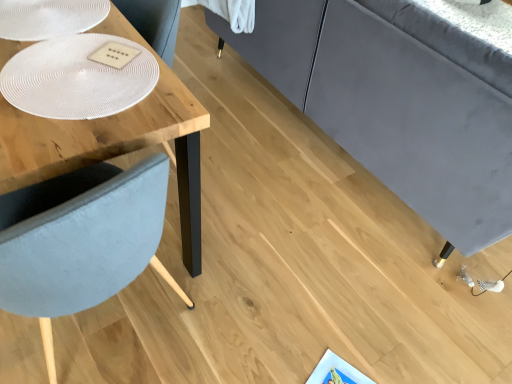
Question: From the image's perspective, is white textured glass plate at upper left, the 1th glass plate when ordered from top to bottom, below wooden table at left?

Choices:
 (A) no
 (B) yes

Answer: (A)

Question: From a real-world perspective, is white textured glass plate at upper left, which is the 2th glass plate in bottom-to-top order, below wooden table at left?

Choices:
 (A) no
 (B) yes

Answer: (A)

Question: Considering the relative sizes of white textured glass plate at upper left, the 1th glass plate when ordered from top to bottom, and wooden table at left in the image provided, is white textured glass plate at upper left, the 1th glass plate when ordered from top to bottom, bigger than wooden table at left?

Choices:
 (A) yes
 (B) no

Answer: (B)

Question: Is white textured glass plate at upper left, the 1th glass plate when ordered from top to bottom, at the right side of wooden table at left?

Choices:
 (A) yes
 (B) no

Answer: (B)

Question: Is white textured glass plate at upper left, which is the 2th glass plate in bottom-to-top order, at the left side of wooden table at left?

Choices:
 (A) yes
 (B) no

Answer: (A)

Question: Is wooden table at left wider or thinner than white textured glass plate at upper left, the 1th glass plate when ordered from top to bottom?

Choices:
 (A) thin
 (B) wide

Answer: (B)

Question: Would you say wooden table at left is to the left or to the right of white textured glass plate at upper left, which is the 2th glass plate in bottom-to-top order, in the picture?

Choices:
 (A) right
 (B) left

Answer: (A)

Question: From a real-world perspective, is wooden table at left above or below white textured glass plate at upper left, which is the 2th glass plate in bottom-to-top order?

Choices:
 (A) below
 (B) above

Answer: (A)

Question: In the image, is wooden table at left positioned in front of or behind white textured glass plate at upper left, the 1th glass plate when ordered from top to bottom?

Choices:
 (A) front
 (B) behind

Answer: (A)

Question: From the image's perspective, is white textured glass plate at upper left, the 1th glass plate when ordered from top to bottom, located above or below wooden table at left?

Choices:
 (A) below
 (B) above

Answer: (B)

Question: In terms of height, does white textured glass plate at upper left, the 1th glass plate when ordered from top to bottom, look taller or shorter compared to wooden table at left?

Choices:
 (A) short
 (B) tall

Answer: (A)

Question: In terms of width, does white textured glass plate at upper left, the 1th glass plate when ordered from top to bottom, look wider or thinner when compared to wooden table at left?

Choices:
 (A) wide
 (B) thin

Answer: (B)

Question: Is point (28, 8) closer or farther from the camera than point (16, 147)?

Choices:
 (A) closer
 (B) farther

Answer: (B)

Question: Considering the positions of white textured glass plate at upper left, marked as the second glass plate in a top-to-bottom arrangement, and white textured glass plate at upper left, which is the 2th glass plate in bottom-to-top order, in the image, is white textured glass plate at upper left, marked as the second glass plate in a top-to-bottom arrangement, wider or thinner than white textured glass plate at upper left, which is the 2th glass plate in bottom-to-top order,?

Choices:
 (A) thin
 (B) wide

Answer: (B)

Question: Is white textured glass plate at upper left, marked as the second glass plate in a top-to-bottom arrangement, bigger or smaller than white textured glass plate at upper left, which is the 2th glass plate in bottom-to-top order?

Choices:
 (A) small
 (B) big

Answer: (B)